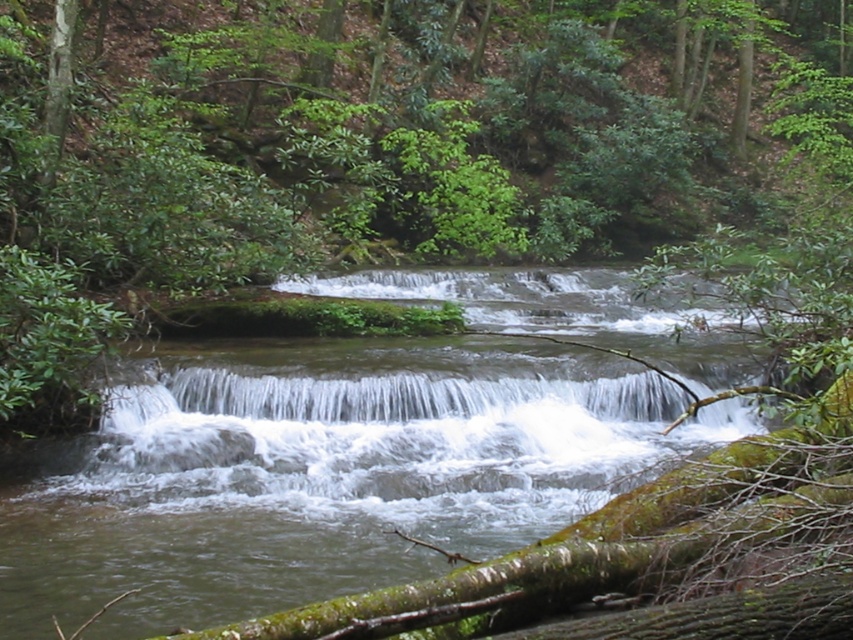
Does clear water at center appear over white frothy water at center?

Actually, clear water at center is below white frothy water at center.

Where is `clear water at center`? Image resolution: width=853 pixels, height=640 pixels. clear water at center is located at coordinates (323, 472).